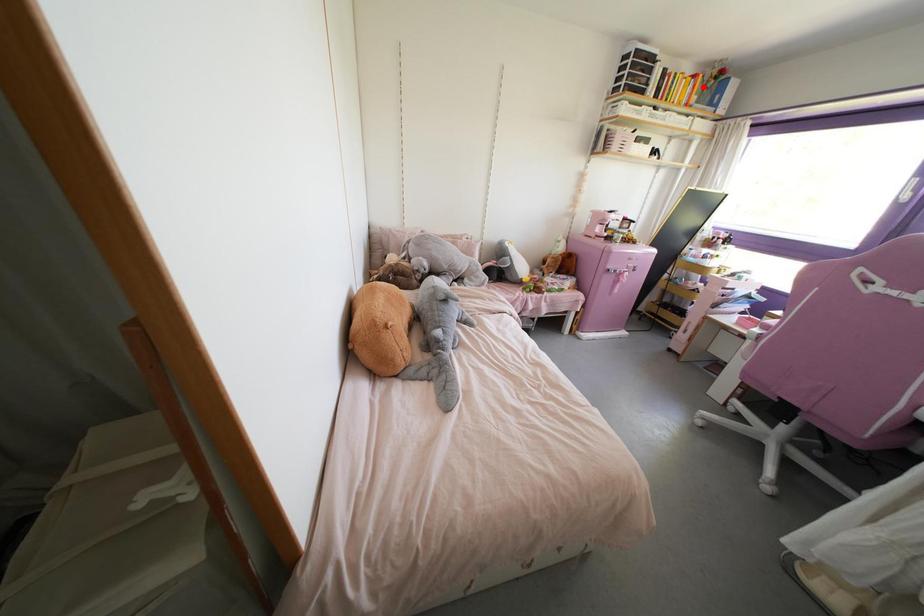
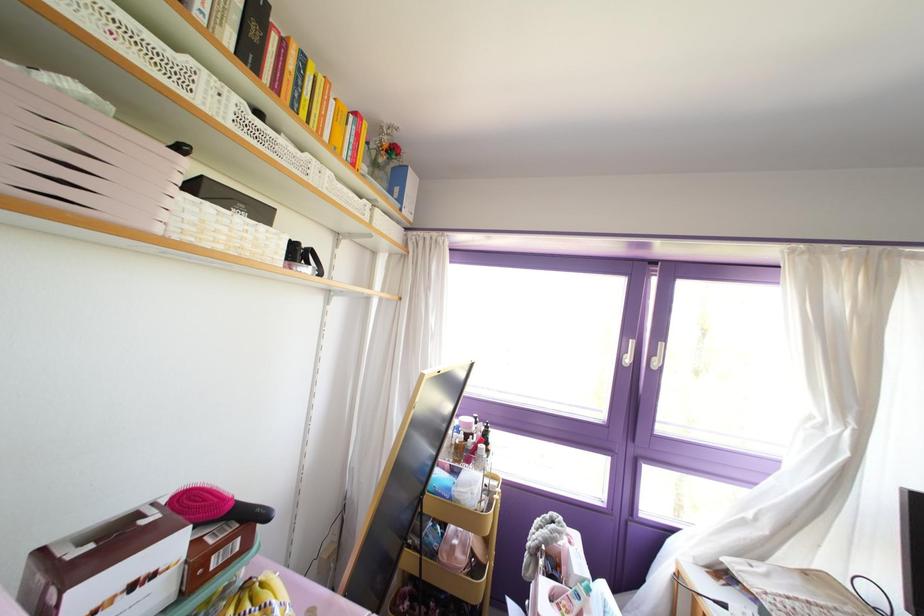
The point at the highlighted location is marked in the first image. Where is the corresponding point in the second image?

(372, 163)